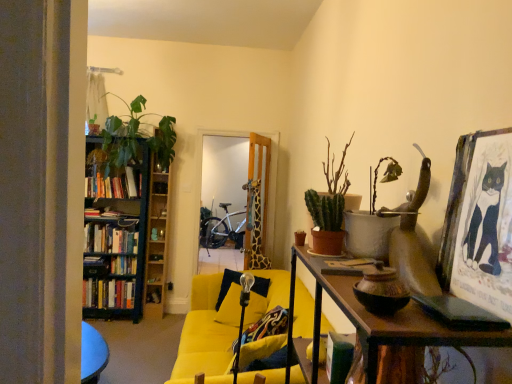
Measure the distance between green leafy plant at left, the 1th houseplant positioned from the back, and camera.

green leafy plant at left, the 1th houseplant positioned from the back, and camera are 3.97 meters apart from each other.

Find the location of a particular element. green matte plant at upper right, the 4th houseplant positioned from the back is located at coordinates (383, 221).

Where is `green matte cactus at center-right, which is the second houseplant in front-to-back order`? This screenshot has width=512, height=384. green matte cactus at center-right, which is the second houseplant in front-to-back order is located at coordinates (326, 222).

Locate an element on the screen. Image resolution: width=512 pixels, height=384 pixels. hardcover books at left, arranged as the first book when viewed from the top is located at coordinates (114, 185).

This screenshot has height=384, width=512. Identify the location of green leafy plant at left, the 4th houseplant positioned from the right. (136, 137).

Consider the image. Is silver metallic bicycle at center aimed at velvet blue pillow at center?

Yes, silver metallic bicycle at center faces towards velvet blue pillow at center.

From a real-world perspective, is silver metallic bicycle at center positioned above or below velvet blue pillow at center?

silver metallic bicycle at center is situated lower than velvet blue pillow at center in the real world.

From the image's perspective, is silver metallic bicycle at center on top of velvet blue pillow at center?

Yes, from the image's perspective, silver metallic bicycle at center is on top of velvet blue pillow at center.

Between point (231, 204) and point (237, 321), which one is positioned behind?

Positioned behind is point (231, 204).

Find the location of `bicycle that appears behind the wooden bookshelf at left`. bicycle that appears behind the wooden bookshelf at left is located at coordinates (219, 228).

Which is closer, (126, 174) or (233, 236)?

The point (126, 174) is more forward.

Can silver metallic bicycle at center be found inside wooden bookshelf at left?

Actually, silver metallic bicycle at center is outside wooden bookshelf at left.

Does velvet blue pillow at center appear on the right side of yellow fabric couch at center?

No, velvet blue pillow at center is not to the right of yellow fabric couch at center.

Considering the relative sizes of velvet blue pillow at center and yellow fabric couch at center in the image provided, is velvet blue pillow at center thinner than yellow fabric couch at center?

Correct, the width of velvet blue pillow at center is less than that of yellow fabric couch at center.

Which object is further away from the camera, velvet blue pillow at center or yellow fabric couch at center?

velvet blue pillow at center is further from the camera.

Considering the sizes of objects green leafy plant at left, the 4th houseplant positioned from the right, and hardcover books at left, arranged as the first book when viewed from the top, in the image provided, who is smaller, green leafy plant at left, the 4th houseplant positioned from the right, or hardcover books at left, arranged as the first book when viewed from the top,?

Smaller between the two is hardcover books at left, arranged as the first book when viewed from the top.

Does green leafy plant at left, arranged as the first houseplant when viewed from the left, appear on the right side of hardcover books at left, arranged as the 3th book when ordered from the bottom?

Correct, you'll find green leafy plant at left, arranged as the first houseplant when viewed from the left, to the right of hardcover books at left, arranged as the 3th book when ordered from the bottom.

Does green leafy plant at left, arranged as the first houseplant when viewed from the left, have a greater height compared to hardcover books at left, arranged as the first book when viewed from the top?

Yes.

Could you tell me if green leafy plant at left, arranged as the first houseplant when viewed from the left, is turned towards hardcover books at left, arranged as the 3th book when ordered from the bottom?

No, green leafy plant at left, arranged as the first houseplant when viewed from the left, is not facing towards hardcover books at left, arranged as the 3th book when ordered from the bottom.

Is silver metallic bicycle at center a part of hardcover books at left, acting as the second book starting from the bottom?

Definitely not — silver metallic bicycle at center is not inside hardcover books at left, acting as the second book starting from the bottom.

Starting from the silver metallic bicycle at center, which book is the 2nd one in front? Please provide its 2D coordinates.

[(109, 239)]

Between hardcover books at left, which is the 2th book from top to bottom, and silver metallic bicycle at center, which one has larger width?

silver metallic bicycle at center is wider.

From a real-world perspective, is hardcover books at left, acting as the second book starting from the bottom, under silver metallic bicycle at center?

No, from a real-world perspective, hardcover books at left, acting as the second book starting from the bottom, is not below silver metallic bicycle at center.

Is point (362, 236) behind point (478, 228)?

That is True.

Based on the photo, is green matte plant at upper right, arranged as the first houseplant when viewed from the right, to the left of wooden framed poster at upper right from the viewer's perspective?

Indeed, green matte plant at upper right, arranged as the first houseplant when viewed from the right, is positioned on the left side of wooden framed poster at upper right.

How distant is green matte plant at upper right, the 4th houseplant positioned from the back, from wooden framed poster at upper right?

green matte plant at upper right, the 4th houseplant positioned from the back, and wooden framed poster at upper right are 9.29 inches apart from each other.

Considering their positions, is green matte plant at upper right, arranged as the first houseplant when viewed from the right, located in front of or behind wooden framed poster at upper right?

green matte plant at upper right, arranged as the first houseplant when viewed from the right, is positioned farther from the viewer than wooden framed poster at upper right.

From a real-world perspective, which object rests below the other?

In real-world perspective, silver metallic bicycle at center is lower.

Locate an element on the screen. This screenshot has height=384, width=512. bicycle behind the hardcover books at left, arranged as the 3th book when ordered from the bottom is located at coordinates (219, 228).

Which is closer to the camera, (125,178) or (225,236)?

Point (125,178) appears to be closer to the viewer than point (225,236).

At what (x,y) coordinates should I click in order to perform the action: click on bicycle located on the left of velvet blue pillow at center. Please return your answer as a coordinate pair (x, y). The height and width of the screenshot is (384, 512). Looking at the image, I should click on (219, 228).

This screenshot has height=384, width=512. In order to click on bookcase that is in front of the silver metallic bicycle at center in this screenshot , I will do `click(117, 244)`.

From the image, which object appears to be nearer to hardcover books at left, which is the 2th book from top to bottom, silver metallic bicycle at center or hardcover books at left, which appears as the first book when ordered from the bottom?

Based on the image, hardcover books at left, which appears as the first book when ordered from the bottom, appears to be nearer to hardcover books at left, which is the 2th book from top to bottom.

Which object lies nearer to the anchor point green leafy plant at left, the 1th houseplant positioned from the back, wooden framed poster at upper right or wooden bookshelf at left?

Based on the image, wooden bookshelf at left appears to be nearer to green leafy plant at left, the 1th houseplant positioned from the back.

Estimate the real-world distances between objects in this image. Which object is closer to hardcover books at left, arranged as the first book when viewed from the top, green matte cactus at upper right, acting as the third houseplant starting from the front, or green leafy plant at left, the 4th houseplant positioned from the right?

green leafy plant at left, the 4th houseplant positioned from the right, is positioned closer to the anchor hardcover books at left, arranged as the first book when viewed from the top.

When comparing their distances from green matte plant at upper right, the 4th houseplant positioned from the back, does clear glass door at center or green leafy plant at left, the 4th houseplant positioned from the right, seem further?

green leafy plant at left, the 4th houseplant positioned from the right, is positioned further to the anchor green matte plant at upper right, the 4th houseplant positioned from the back.

Estimate the real-world distances between objects in this image. Which object is closer to green matte cactus at center-right, positioned as the third houseplant in back-to-front order, wooden bookshelf at left or hardcover books at left, acting as the second book starting from the bottom?

wooden bookshelf at left.

Based on their spatial positions, is yellow fabric couch at center or hardcover books at left, which is the 2th book from top to bottom, further from clear glass door at center?

Based on the image, hardcover books at left, which is the 2th book from top to bottom, appears to be further to clear glass door at center.

Which object lies further to the anchor point hardcover books at left, acting as the second book starting from the bottom, clear glass door at center or wooden bookshelf at left?

clear glass door at center is further to hardcover books at left, acting as the second book starting from the bottom.

Based on the photo, looking at the image, which one is located further to yellow fabric couch at center, hardcover books at left, which is the 2th book from top to bottom, or green matte plant at upper right, the 1th houseplant from the front?

hardcover books at left, which is the 2th book from top to bottom, lies further to yellow fabric couch at center than the other object.

Image resolution: width=512 pixels, height=384 pixels. Identify the location of bookcase between green matte plant at upper right, the 1th houseplant from the front, and silver metallic bicycle at center from front to back. (117, 244).

You are a GUI agent. You are given a task and a screenshot of the screen. Output one action in this format:
    pyautogui.click(x=<x>, y=<y>)
    Task: Click on the book between hardcover books at left, acting as the second book starting from the bottom, and velvet blue pillow at center, in the horizontal direction
    The width and height of the screenshot is (512, 384).
    Given the screenshot: What is the action you would take?
    pyautogui.click(x=114, y=185)

Find the location of a particular element. This screenshot has width=512, height=384. glass door between green matte cactus at center-right, which is the second houseplant in left-to-right order, and hardcover books at left, the 3th book in the top-to-bottom sequence, in the front-back direction is located at coordinates (242, 185).

Identify the location of chair between green matte cactus at upper right, the second houseplant in the back-to-front sequence, and hardcover books at left, the 3th book in the top-to-bottom sequence, from front to back. coord(205,336).